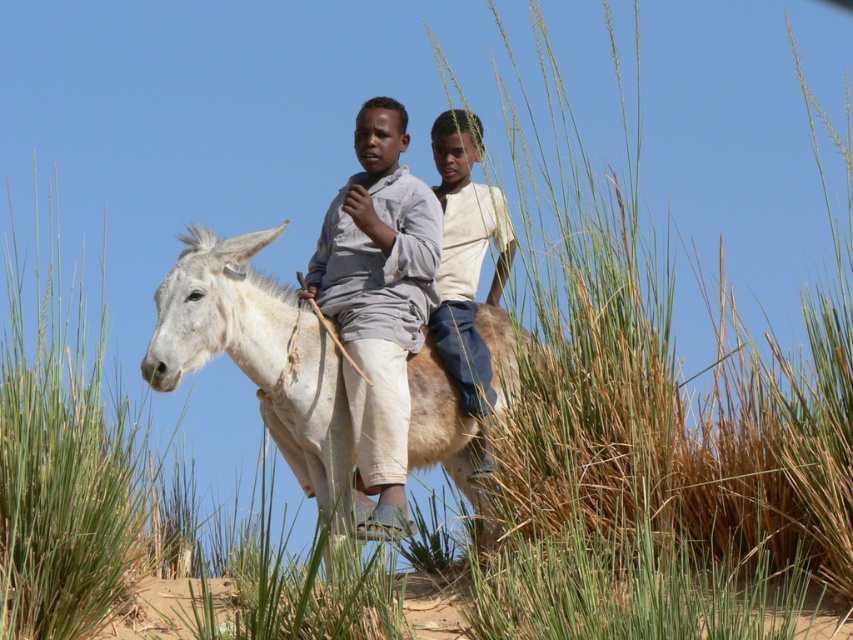
Does light gray cotton shirt at center appear on the left side of light brown cotton shirt at center?

Correct, you'll find light gray cotton shirt at center to the left of light brown cotton shirt at center.

Is light gray cotton shirt at center below light brown cotton shirt at center?

Indeed, light gray cotton shirt at center is positioned under light brown cotton shirt at center.

Does point (364, 150) come behind point (490, 403)?

That is True.

Image resolution: width=853 pixels, height=640 pixels. Identify the location of light gray cotton shirt at center. (378, 304).

Is point (454, 410) behind point (401, 202)?

That is False.

Does point (428, 412) come in front of point (369, 417)?

No, (428, 412) is further to viewer.

Identify the location of white matte mule at center. (258, 355).

Does white matte mule at center appear under light brown cotton shirt at center?

Indeed, white matte mule at center is positioned under light brown cotton shirt at center.

Where is `white matte mule at center`? white matte mule at center is located at coordinates (258, 355).

Between point (305, 417) and point (477, 132), which one is positioned in front?

Point (305, 417) is in front.

You are a GUI agent. You are given a task and a screenshot of the screen. Output one action in this format:
    pyautogui.click(x=<x>, y=<y>)
    Task: Click on the white matte mule at center
    The height and width of the screenshot is (640, 853).
    Given the screenshot: What is the action you would take?
    pyautogui.click(x=258, y=355)